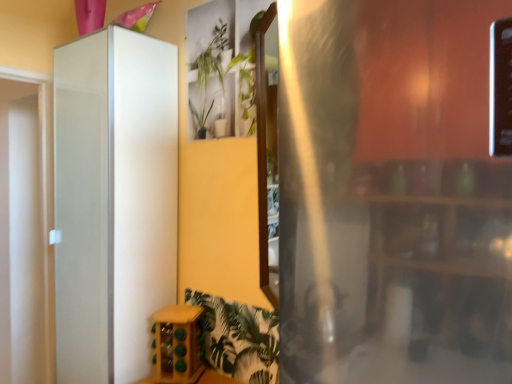
Question: From a real-world perspective, is green leafy plant at upper center physically located above or below white glossy cabinet at left?

Choices:
 (A) above
 (B) below

Answer: (A)

Question: Is green leafy plant at upper center spatially inside white glossy cabinet at left, or outside of it?

Choices:
 (A) outside
 (B) inside

Answer: (A)

Question: Estimate the real-world distances between objects in this image. Which object is farther from the green leafy plant at upper center?

Choices:
 (A) white glossy cabinet at left
 (B) wooden wine rack at lower center

Answer: (B)

Question: Which object is the closest to the white glossy cabinet at left?

Choices:
 (A) wooden wine rack at lower center
 (B) green leafy plant at upper center

Answer: (A)